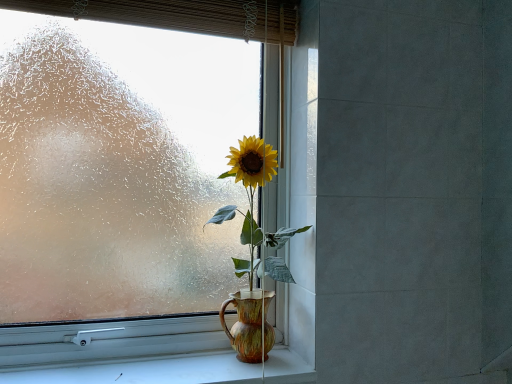
Question: Considering the relative positions of frosted glass window at center and gray tile at right in the image provided, is frosted glass window at center to the right of gray tile at right from the viewer's perspective?

Choices:
 (A) yes
 (B) no

Answer: (B)

Question: Can you confirm if frosted glass window at center is smaller than gray tile at right?

Choices:
 (A) no
 (B) yes

Answer: (B)

Question: Is frosted glass window at center facing away from gray tile at right?

Choices:
 (A) yes
 (B) no

Answer: (B)

Question: From the image's perspective, does frosted glass window at center appear higher than gray tile at right?

Choices:
 (A) no
 (B) yes

Answer: (B)

Question: Is frosted glass window at center not near gray tile at right?

Choices:
 (A) no
 (B) yes

Answer: (A)

Question: Could gray tile at right be considered to be inside frosted glass window at center?

Choices:
 (A) no
 (B) yes

Answer: (A)

Question: Is gray tile at right not close to frosted glass window at center?

Choices:
 (A) no
 (B) yes

Answer: (A)

Question: Can you confirm if gray tile at right is positioned to the right of frosted glass window at center?

Choices:
 (A) yes
 (B) no

Answer: (A)

Question: From the image's perspective, is gray tile at right on top of frosted glass window at center?

Choices:
 (A) yes
 (B) no

Answer: (B)

Question: From the image's perspective, is gray tile at right below frosted glass window at center?

Choices:
 (A) yes
 (B) no

Answer: (A)

Question: Is gray tile at right positioned in front of frosted glass window at center?

Choices:
 (A) no
 (B) yes

Answer: (B)

Question: Can frosted glass window at center be found inside gray tile at right?

Choices:
 (A) yes
 (B) no

Answer: (B)

Question: Would you say white smooth window sill at lower center is a long distance from matte ceramic vase at center?

Choices:
 (A) yes
 (B) no

Answer: (B)